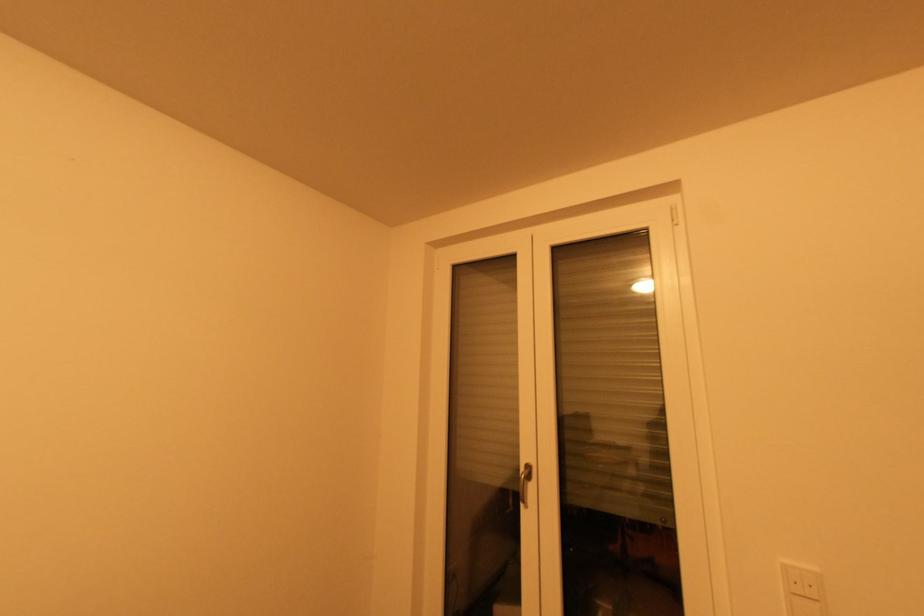
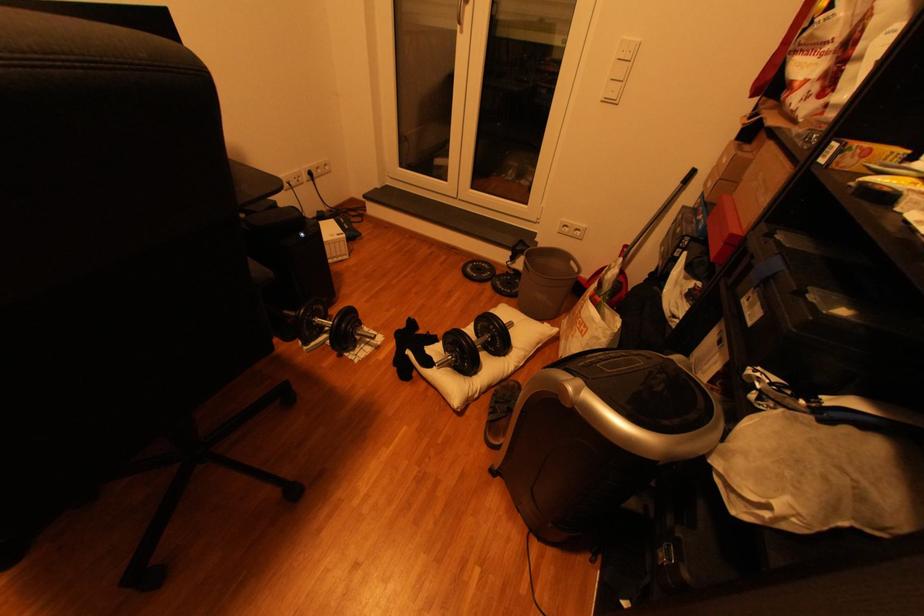
Question: The first image is from the beginning of the video and the second image is from the end. How did the camera likely rotate when shooting the video?

Choices:
 (A) Left
 (B) Right
 (C) Up
 (D) Down

Answer: (D)